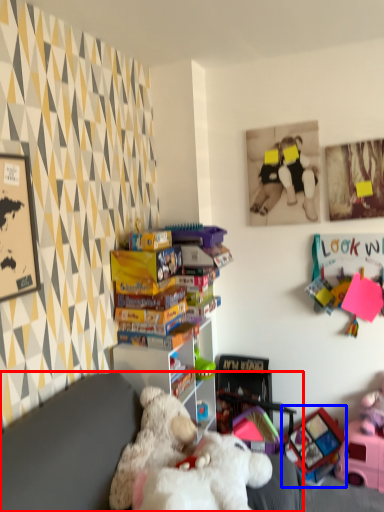
Question: Which object is closer to the camera taking this photo, furniture (highlighted by a red box) or toy (highlighted by a blue box)?

Choices:
 (A) furniture
 (B) toy

Answer: (A)